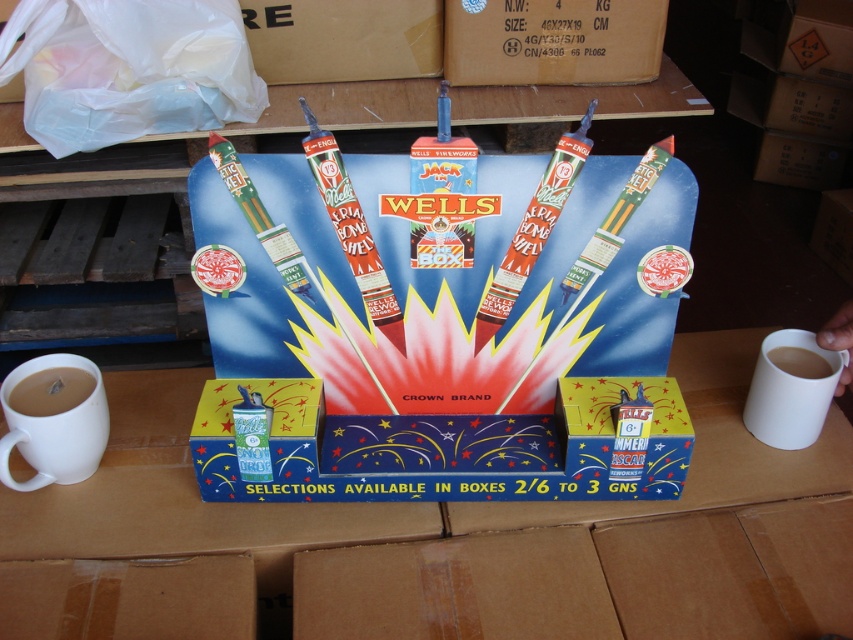
Question: Which point is farther to the camera?

Choices:
 (A) white matte mug at lower left
 (B) cardboard box at center
 (C) white matte mug at right

Answer: (A)

Question: Is cardboard box at center thinner than brown cardboard box at upper center?

Choices:
 (A) no
 (B) yes

Answer: (A)

Question: Does cardboard box at center come behind brown cardboard box at upper center?

Choices:
 (A) no
 (B) yes

Answer: (A)

Question: Which point is closer to the camera taking this photo?

Choices:
 (A) (785, 433)
 (B) (367, 611)
 (C) (71, 456)
 (D) (640, 3)

Answer: (B)

Question: Among these objects, which one is nearest to the camera?

Choices:
 (A) white matte mug at left
 (B) white matte mug at right
 (C) cardboard box at center
 (D) brown cardboard box at upper center

Answer: (C)

Question: Can you confirm if brown cardboard at center is positioned to the right of white matte mug at left?

Choices:
 (A) no
 (B) yes

Answer: (B)